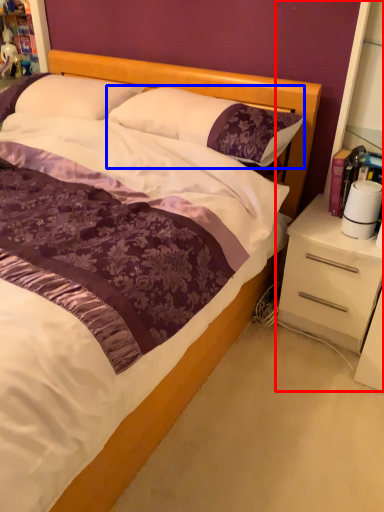
Question: Among these objects, which one is nearest to the camera, dresser (highlighted by a red box) or pillow (highlighted by a blue box)?

Choices:
 (A) dresser
 (B) pillow

Answer: (A)